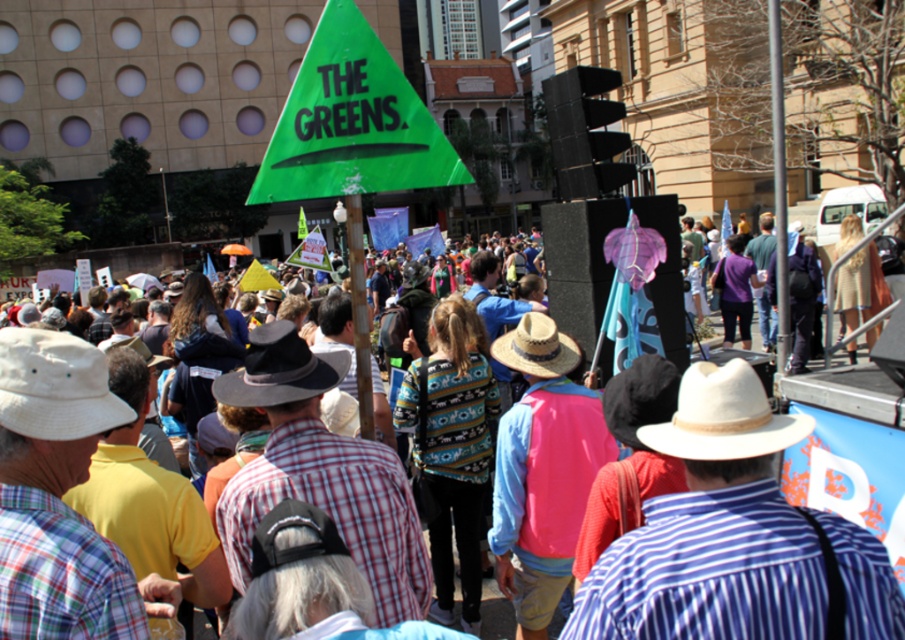
You are a photographer trying to capture a clear photo of the dark brown felt cowboy hat at center and the strawhat at center. Since you want both hats to be clearly visible, which hat should you focus on first to ensure it appears sharp in the photo?

The dark brown felt cowboy hat at center is larger in size than strawhat at center, so you should focus on the dark brown felt cowboy hat at center first to ensure it appears sharp in the photo.